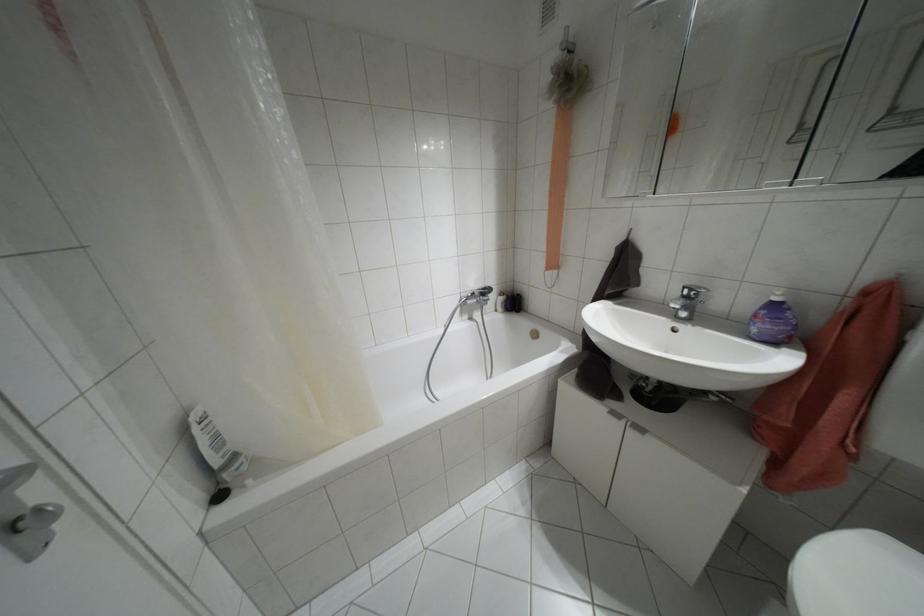
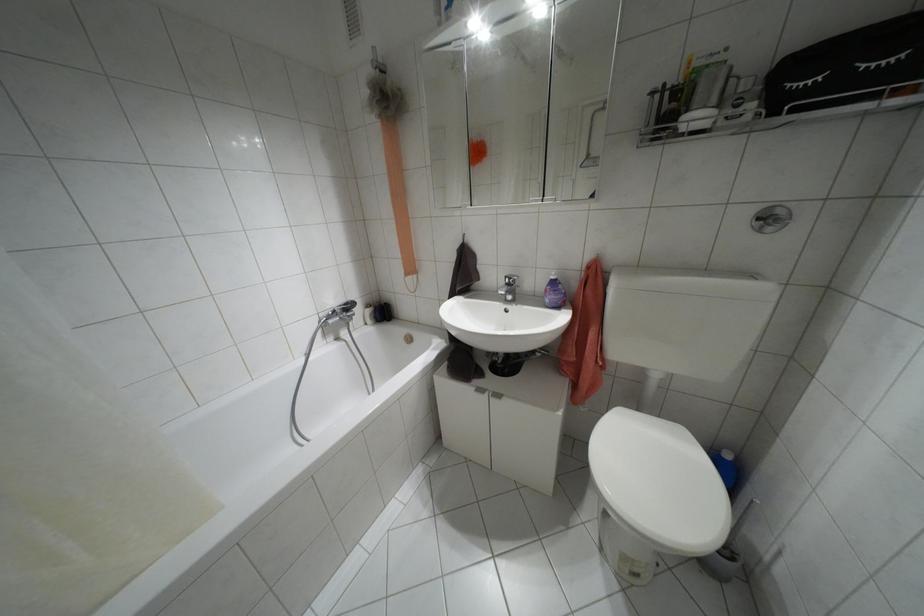
Find the pixel in the second image that matches [500,293] in the first image.

(367, 305)